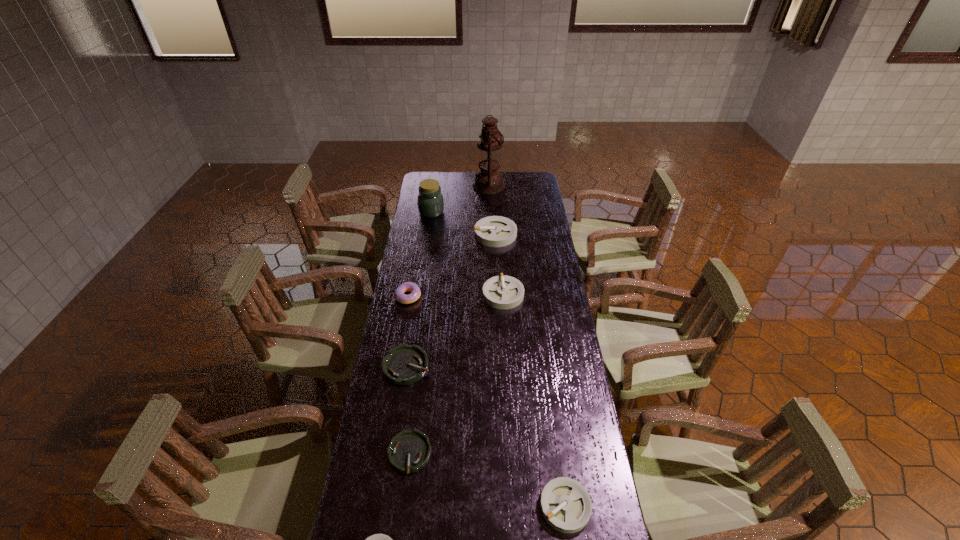
Identify the location of the tallest object. The height and width of the screenshot is (540, 960). (488, 181).

This screenshot has width=960, height=540. What are the coordinates of `oil lamp` in the screenshot? It's located at (488, 181).

What are the coordinates of `the eighth shortest object` in the screenshot? It's located at (430, 200).

The height and width of the screenshot is (540, 960). I want to click on the eighth nearest object, so click(x=430, y=200).

You are a GUI agent. You are given a task and a screenshot of the screen. Output one action in this format:
    pyautogui.click(x=<x>, y=<y>)
    Task: Click on the seventh shortest object
    The image size is (960, 540).
    Given the screenshot: What is the action you would take?
    pyautogui.click(x=493, y=231)

The height and width of the screenshot is (540, 960). What are the coordinates of `the farthest gray ashtray` in the screenshot? It's located at (493, 231).

I want to click on the second biggest gray ashtray, so click(502, 292).

At what (x,y) coordinates should I click in order to perform the action: click on the second farthest gray ashtray. Please return your answer as a coordinate pair (x, y). The height and width of the screenshot is (540, 960). Looking at the image, I should click on (502, 292).

Where is `pink doughnut`? This screenshot has width=960, height=540. pink doughnut is located at coordinates (411, 287).

I want to click on the third tallest ashtray, so click(566, 506).